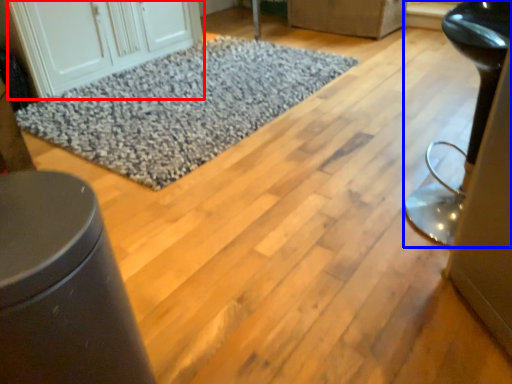
Question: Which object appears farthest to the camera in this image, cabinetry (highlighted by a red box) or furniture (highlighted by a blue box)?

Choices:
 (A) cabinetry
 (B) furniture

Answer: (A)